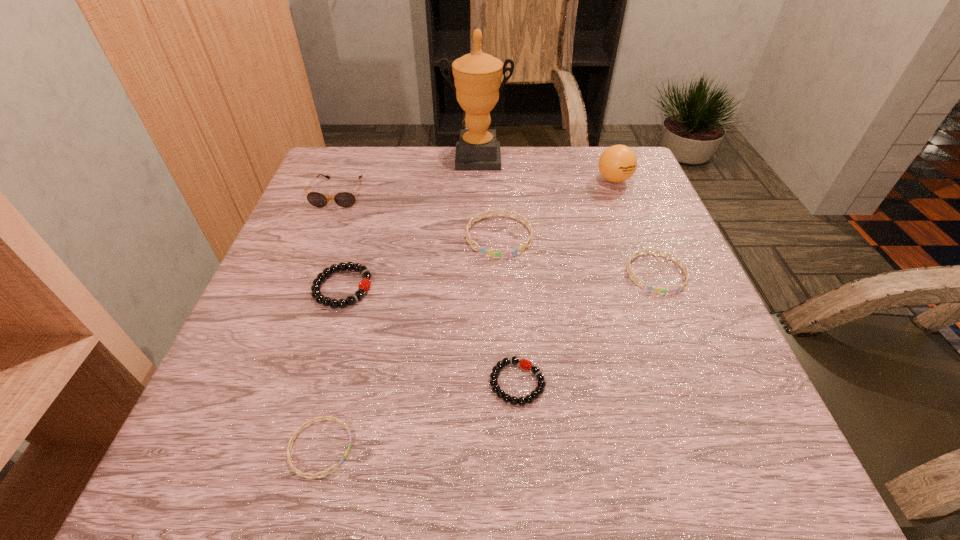
Find the location of `vacant area situated on the right of the fourth farthest bracelet`. vacant area situated on the right of the fourth farthest bracelet is located at coordinates (713, 383).

This screenshot has height=540, width=960. What are the coordinates of `free space located 0.260m on the surface of the shortest bracelet showing star-shaped elements` in the screenshot? It's located at (533, 448).

Find the location of a particular element. Image resolution: width=960 pixels, height=540 pixels. award present at the far edge is located at coordinates (477, 76).

Where is `ping-pong ball situated at the far edge`? This screenshot has height=540, width=960. ping-pong ball situated at the far edge is located at coordinates (617, 163).

You are a GUI agent. You are given a task and a screenshot of the screen. Output one action in this format:
    pyautogui.click(x=<x>, y=<y>)
    Task: Click on the sunglasses positioned at the far edge
    Image resolution: width=960 pixels, height=540 pixels.
    Given the screenshot: What is the action you would take?
    pyautogui.click(x=343, y=199)

Find the location of a particular element. The width and height of the screenshot is (960, 540). object positioned at the near edge is located at coordinates (302, 474).

Image resolution: width=960 pixels, height=540 pixels. In order to click on sunglasses located at the left edge in this screenshot , I will do `click(343, 199)`.

Image resolution: width=960 pixels, height=540 pixels. I want to click on ping-pong ball at the right edge, so click(x=617, y=163).

Where is `bracelet located in the right edge section of the desktop`? Image resolution: width=960 pixels, height=540 pixels. bracelet located in the right edge section of the desktop is located at coordinates (650, 288).

Identify the location of object located in the far left corner section of the desktop. (343, 199).